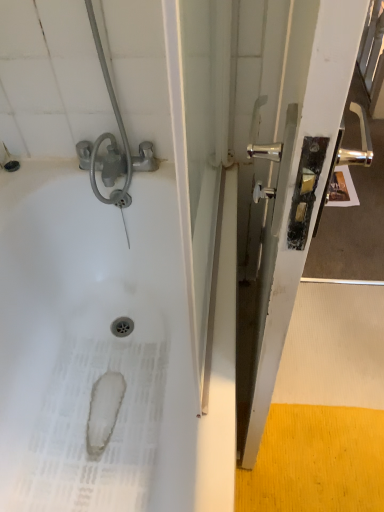
Question: Relative to white glossy bathtub at upper left, is metallic silver handle at right in front or behind?

Choices:
 (A) behind
 (B) front

Answer: (B)

Question: Considering the positions of metallic silver handle at right and white glossy bathtub at upper left in the image, is metallic silver handle at right bigger or smaller than white glossy bathtub at upper left?

Choices:
 (A) small
 (B) big

Answer: (A)

Question: Is metallic silver handle at right taller or shorter than white glossy bathtub at upper left?

Choices:
 (A) tall
 (B) short

Answer: (A)

Question: From the image's perspective, is white glossy bathtub at upper left located above or below metallic silver handle at right?

Choices:
 (A) above
 (B) below

Answer: (B)

Question: From a real-world perspective, is white glossy bathtub at upper left physically located above or below metallic silver handle at right?

Choices:
 (A) below
 (B) above

Answer: (A)

Question: In terms of size, does white glossy bathtub at upper left appear bigger or smaller than metallic silver handle at right?

Choices:
 (A) small
 (B) big

Answer: (B)

Question: Considering the positions of white glossy bathtub at upper left and metallic silver handle at right in the image, is white glossy bathtub at upper left wider or thinner than metallic silver handle at right?

Choices:
 (A) thin
 (B) wide

Answer: (B)